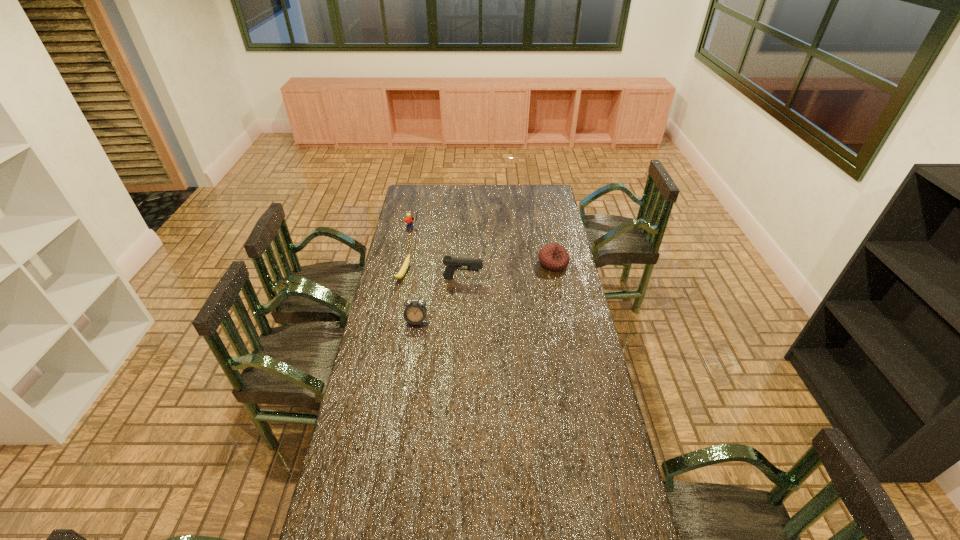
Where is `Lego that is at the left edge`? Image resolution: width=960 pixels, height=540 pixels. Lego that is at the left edge is located at coordinates (409, 220).

Where is `object that is at the right edge`? object that is at the right edge is located at coordinates pos(554,257).

The height and width of the screenshot is (540, 960). In order to click on vacant area at the left edge of the desktop in this screenshot , I will do `click(416, 255)`.

Locate an element on the screen. This screenshot has height=540, width=960. free point at the right edge is located at coordinates (550, 235).

This screenshot has width=960, height=540. What are the coordinates of `free space between the pistol and the farthest object` in the screenshot? It's located at (438, 253).

Find the location of a particular element. vacant space that is in between the farthest object and the rightmost object is located at coordinates (483, 246).

Identify the location of empty space between the nearest object and the beanbag. The width and height of the screenshot is (960, 540). (485, 292).

At what (x,y) coordinates should I click in order to perform the action: click on free point between the Lego and the banana. Please return your answer as a coordinate pair (x, y). The height and width of the screenshot is (540, 960). Looking at the image, I should click on (408, 251).

The width and height of the screenshot is (960, 540). In order to click on vacant space that's between the farthest object and the banana in this screenshot , I will do click(408, 251).

Identify the location of free spot between the nearest object and the second shortest object. (485, 292).